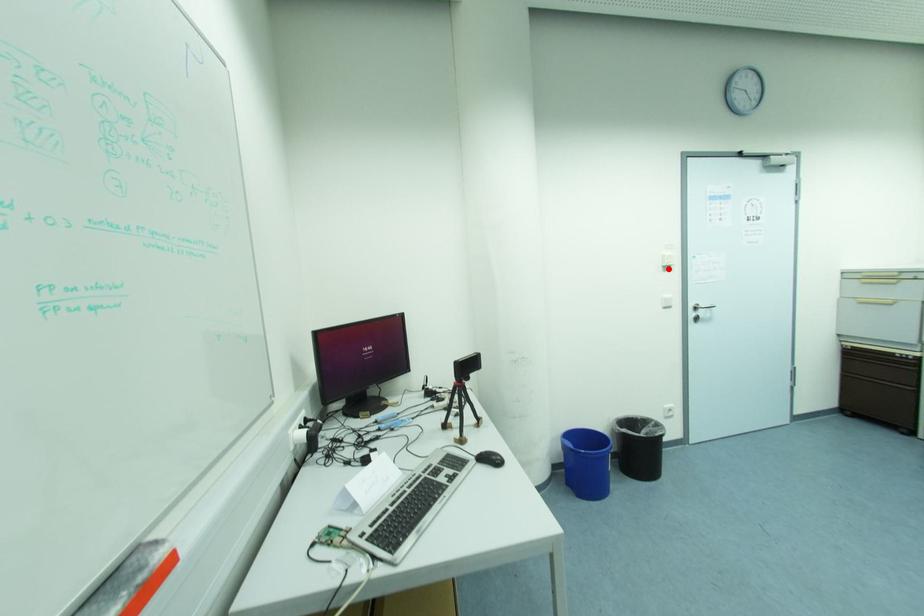
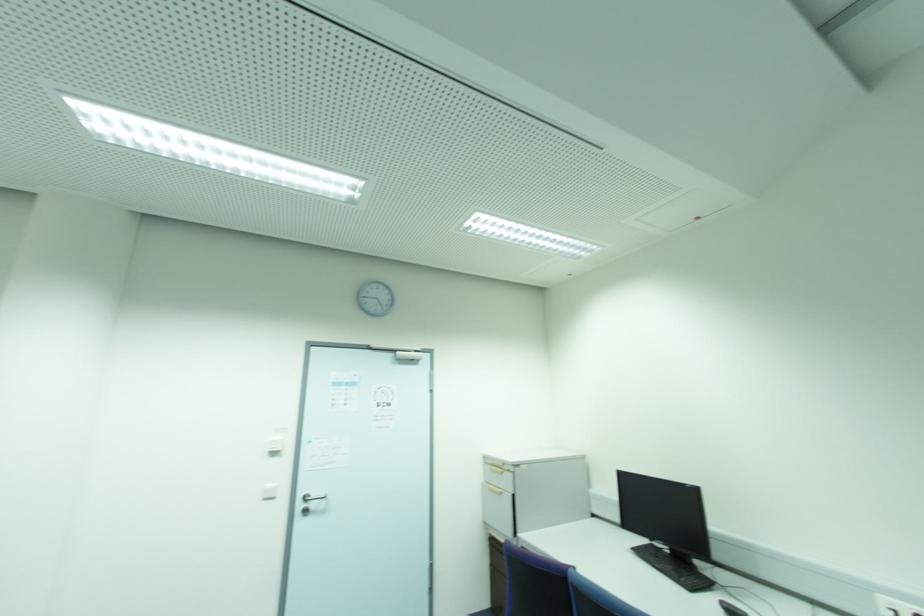
The point at the highlighted location is marked in the first image. Where is the corresponding point in the second image?

(274, 454)